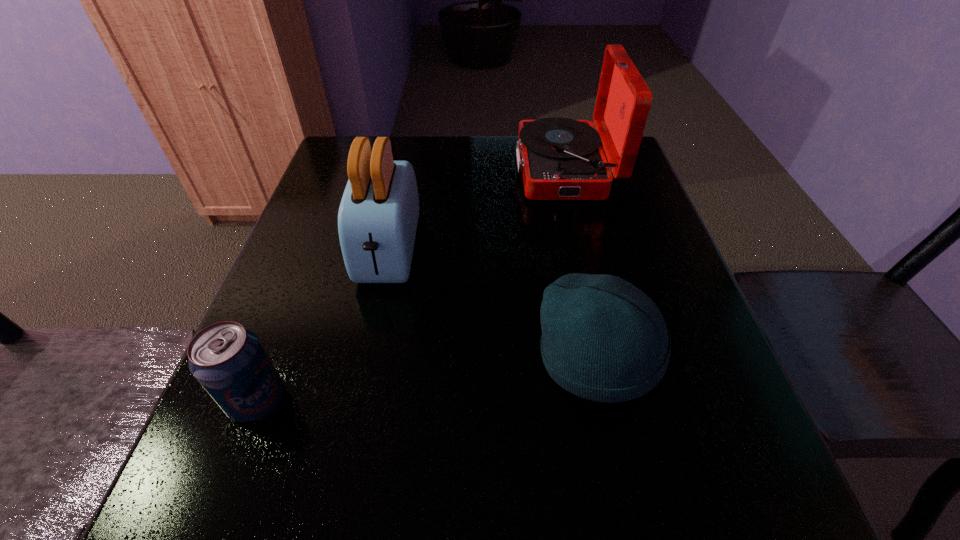
At what (x,y) coordinates should I click in order to perform the action: click on the farthest object. Please return your answer as a coordinate pair (x, y). Looking at the image, I should click on (560, 159).

At what (x,y) coordinates should I click in order to perform the action: click on the second object from left to right. Please return your answer as a coordinate pair (x, y). The width and height of the screenshot is (960, 540). Looking at the image, I should click on (378, 215).

The image size is (960, 540). I want to click on toaster, so click(x=378, y=215).

I want to click on beanie, so click(603, 339).

I want to click on the leftmost object, so pyautogui.click(x=228, y=360).

The height and width of the screenshot is (540, 960). In order to click on free space located on the front-facing side of the farthest object in this screenshot , I will do `click(368, 170)`.

You are a GUI agent. You are given a task and a screenshot of the screen. Output one action in this format:
    pyautogui.click(x=<x>, y=<y>)
    Task: Click on the vacant region located on the front-facing side of the farthest object
    Image resolution: width=960 pixels, height=540 pixels.
    Given the screenshot: What is the action you would take?
    pyautogui.click(x=372, y=170)

The width and height of the screenshot is (960, 540). Identify the location of vacant space located on the front-facing side of the farthest object. (364, 170).

Locate an element on the screen. This screenshot has width=960, height=540. free space located on the side of the second farthest object with the lever is located at coordinates (350, 434).

The height and width of the screenshot is (540, 960). In order to click on free spot located 0.060m on the front of the beanie in this screenshot , I will do `click(618, 454)`.